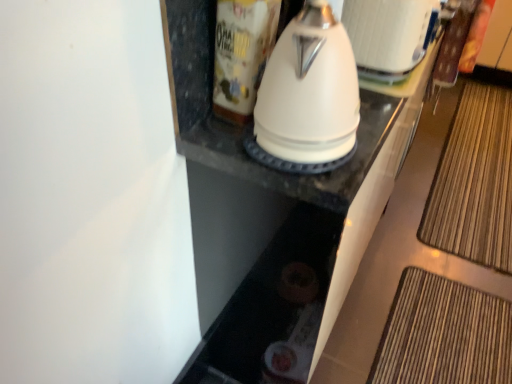
Question: Considering the relative sizes of bamboo mat at lower right and white glossy canister at upper center in the image provided, is bamboo mat at lower right bigger than white glossy canister at upper center?

Choices:
 (A) no
 (B) yes

Answer: (B)

Question: Is bamboo mat at lower right further to the viewer compared to white glossy canister at upper center?

Choices:
 (A) no
 (B) yes

Answer: (B)

Question: Is bamboo mat at lower right to the left of white glossy canister at upper center from the viewer's perspective?

Choices:
 (A) yes
 (B) no

Answer: (B)

Question: Is bamboo mat at lower right wider than white glossy canister at upper center?

Choices:
 (A) no
 (B) yes

Answer: (B)

Question: From a real-world perspective, does bamboo mat at lower right stand above white glossy canister at upper center?

Choices:
 (A) no
 (B) yes

Answer: (A)

Question: Could you tell me if bamboo mat at lower right is turned towards white glossy canister at upper center?

Choices:
 (A) yes
 (B) no

Answer: (B)

Question: Can white glossy kettle at center be found inside bamboo mat at lower right?

Choices:
 (A) yes
 (B) no

Answer: (B)

Question: From a real-world perspective, does bamboo mat at lower right sit lower than white glossy kettle at center?

Choices:
 (A) yes
 (B) no

Answer: (A)

Question: Is bamboo mat at lower right touching white glossy kettle at center?

Choices:
 (A) yes
 (B) no

Answer: (B)

Question: From the image's perspective, is bamboo mat at lower right under white glossy kettle at center?

Choices:
 (A) yes
 (B) no

Answer: (B)

Question: Is bamboo mat at lower right shorter than white glossy kettle at center?

Choices:
 (A) yes
 (B) no

Answer: (A)

Question: Is white glossy kettle at center at the back of bamboo mat at lower right?

Choices:
 (A) yes
 (B) no

Answer: (B)

Question: From a real-world perspective, is white glossy kettle at upper center below white glossy kettle at center?

Choices:
 (A) yes
 (B) no

Answer: (A)